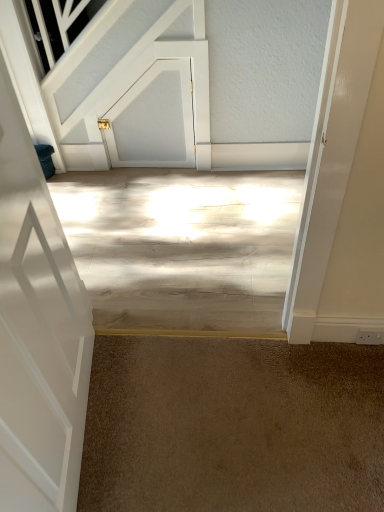
This screenshot has width=384, height=512. What do you see at coordinates (38, 331) in the screenshot?
I see `white glossy door at left, marked as the first door in a front-to-back arrangement` at bounding box center [38, 331].

Locate an element on the screen. This screenshot has height=512, width=384. white glossy door at left, marked as the first door in a front-to-back arrangement is located at coordinates (38, 331).

The image size is (384, 512). What are the coordinates of `white glossy door at left, the 2th door from the top` in the screenshot? It's located at (38, 331).

Considering the relative sizes of white glossy door at left, marked as the first door in a front-to-back arrangement, and brown carpet at lower center in the image provided, is white glossy door at left, marked as the first door in a front-to-back arrangement, wider than brown carpet at lower center?

In fact, white glossy door at left, marked as the first door in a front-to-back arrangement, might be narrower than brown carpet at lower center.

Between white glossy door at left, which ranks as the 2th door in back-to-front order, and brown carpet at lower center, which one has smaller size?

Smaller between the two is brown carpet at lower center.

Which is less distant, (23, 269) or (229, 380)?

Positioned in front is point (23, 269).

Is white glossy door at left, the 2th door from the top, completely or partially inside white matte door at upper center, the first door viewed from the back?

That's incorrect, white glossy door at left, the 2th door from the top, is not inside white matte door at upper center, the first door viewed from the back.

Looking at their sizes, would you say white matte door at upper center, the 1th door viewed from the top, is wider or thinner than white glossy door at left, acting as the 1th door starting from the bottom?

In the image, white matte door at upper center, the 1th door viewed from the top, appears to be more narrow than white glossy door at left, acting as the 1th door starting from the bottom.

Which of these two, white matte door at upper center, the 1th door viewed from the top, or white glossy door at left, marked as the first door in a front-to-back arrangement, is bigger?

white glossy door at left, marked as the first door in a front-to-back arrangement.

Is white matte door at upper center, the second door viewed from the front, taller or shorter than white glossy door at left, which ranks as the 2th door in back-to-front order?

Considering their sizes, white matte door at upper center, the second door viewed from the front, has less height than white glossy door at left, which ranks as the 2th door in back-to-front order.

Which object is closer to the camera taking this photo, white glossy door at left, marked as the first door in a front-to-back arrangement, or white matte door at upper center, the second door viewed from the front?

Positioned in front is white glossy door at left, marked as the first door in a front-to-back arrangement.

Is white glossy door at left, the 2th door from the top, positioned with its back to white matte door at upper center, the 2th door ordered from the bottom?

That's not correct — white glossy door at left, the 2th door from the top, is not looking away from white matte door at upper center, the 2th door ordered from the bottom.

In terms of height, does white glossy door at left, acting as the 1th door starting from the bottom, look taller or shorter compared to white matte door at upper center, the first door viewed from the back?

white glossy door at left, acting as the 1th door starting from the bottom, is taller than white matte door at upper center, the first door viewed from the back.

Locate an element on the screen. door behind the white glossy door at left, marked as the first door in a front-to-back arrangement is located at coordinates (154, 119).

Between white matte door at upper center, the 1th door viewed from the top, and brown carpet at lower center, which one appears on the right side from the viewer's perspective?

brown carpet at lower center is more to the right.

Is white matte door at upper center, the 1th door viewed from the top, bigger than brown carpet at lower center?

No, white matte door at upper center, the 1th door viewed from the top, is not bigger than brown carpet at lower center.

From the picture: From the image's perspective, which is below, white matte door at upper center, the 2th door ordered from the bottom, or brown carpet at lower center?

brown carpet at lower center appears lower in the image.

Is white matte door at upper center, the second door viewed from the front, positioned behind brown carpet at lower center?

Yes, white matte door at upper center, the second door viewed from the front, is further from the camera.

Between brown carpet at lower center and white matte door at upper center, the 1th door viewed from the top, which one appears on the right side from the viewer's perspective?

brown carpet at lower center.

Is point (349, 461) closer or farther from the camera than point (160, 127)?

Point (349, 461) is closer to the camera than point (160, 127).

Can you tell me how much brown carpet at lower center and white matte door at upper center, the first door viewed from the back, differ in facing direction?

brown carpet at lower center and white matte door at upper center, the first door viewed from the back, are facing 179 degrees away from each other.

From the image's perspective, is brown carpet at lower center located above or below white matte door at upper center, the first door viewed from the back?

brown carpet at lower center is below white matte door at upper center, the first door viewed from the back.

Can you confirm if brown carpet at lower center is bigger than white glossy door at left, acting as the 1th door starting from the bottom?

Actually, brown carpet at lower center might be smaller than white glossy door at left, acting as the 1th door starting from the bottom.

Considering the relative sizes of brown carpet at lower center and white glossy door at left, marked as the first door in a front-to-back arrangement, in the image provided, is brown carpet at lower center wider than white glossy door at left, marked as the first door in a front-to-back arrangement,?

Yes, brown carpet at lower center is wider than white glossy door at left, marked as the first door in a front-to-back arrangement.

From a real-world perspective, is brown carpet at lower center located beneath white glossy door at left, marked as the first door in a front-to-back arrangement?

Yes, from a real-world perspective, brown carpet at lower center is under white glossy door at left, marked as the first door in a front-to-back arrangement.

From the image's perspective, would you say brown carpet at lower center is shown under white glossy door at left, the 2th door from the top?

Correct, brown carpet at lower center appears lower than white glossy door at left, the 2th door from the top, in the image.

Identify the location of the 1st door above when counting from the brown carpet at lower center (from the image's perspective). (38, 331).

The image size is (384, 512). Find the location of `door on the left of white matte door at upper center, the first door viewed from the back`. door on the left of white matte door at upper center, the first door viewed from the back is located at coordinates (38, 331).

From the image, which object appears to be nearer to white glossy door at left, the 2th door from the top, white matte door at upper center, the second door viewed from the front, or brown carpet at lower center?

Answer: brown carpet at lower center is positioned closer to the anchor white glossy door at left, the 2th door from the top.

When comparing their distances from brown carpet at lower center, does white glossy door at left, which ranks as the 2th door in back-to-front order, or white matte door at upper center, the 2th door ordered from the bottom, seem further?

white matte door at upper center, the 2th door ordered from the bottom, is positioned further to the anchor brown carpet at lower center.

Estimate the real-world distances between objects in this image. Which object is closer to white glossy door at left, marked as the first door in a front-to-back arrangement, brown carpet at lower center or white matte door at upper center, the 2th door ordered from the bottom?

The object closer to white glossy door at left, marked as the first door in a front-to-back arrangement, is brown carpet at lower center.

Considering their positions, is brown carpet at lower center positioned closer to white matte door at upper center, the 2th door ordered from the bottom, than white glossy door at left, which ranks as the 2th door in back-to-front order?

white glossy door at left, which ranks as the 2th door in back-to-front order, is closer to white matte door at upper center, the 2th door ordered from the bottom.

Looking at the image, which one is located further to white matte door at upper center, the second door viewed from the front, white glossy door at left, the 2th door from the top, or brown carpet at lower center?

Among the two, brown carpet at lower center is located further to white matte door at upper center, the second door viewed from the front.

Looking at the image, which one is located further to brown carpet at lower center, white matte door at upper center, the 2th door ordered from the bottom, or white glossy door at left, which ranks as the 2th door in back-to-front order?

The object further to brown carpet at lower center is white matte door at upper center, the 2th door ordered from the bottom.

Locate an element on the screen. Image resolution: width=384 pixels, height=512 pixels. concrete between white glossy door at left, which ranks as the 2th door in back-to-front order, and white matte door at upper center, the 1th door viewed from the top, along the z-axis is located at coordinates (233, 426).